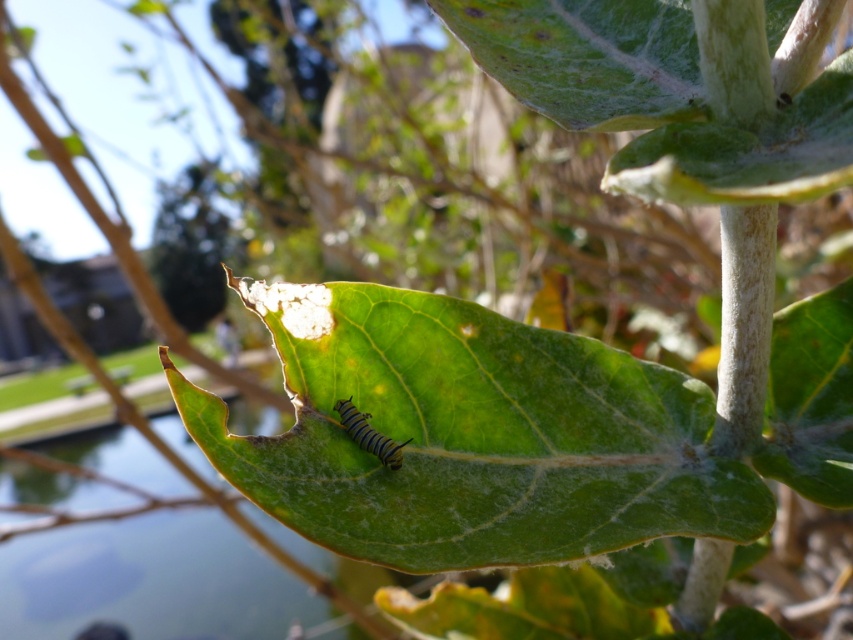
You are observing a monarch caterpillar on a leaf. There are two points marked on the leaf surface, one at point coordinates point (509, 336) and another at point coordinates point (363, 442). If you were to touch both points with a pencil, which point would require your pencil to move closer to you compared to the other?

Point (363, 442) would require your pencil to move closer to you because it is closer to you than point (509, 336), which is further away.

In the scene shown: You are an entomologist observing the green matte leaf at center and the yellow striped caterpillar at center. Which object is closer to you?

The green matte leaf at center is closer to you because it is positioned in front of the yellow striped caterpillar at center.